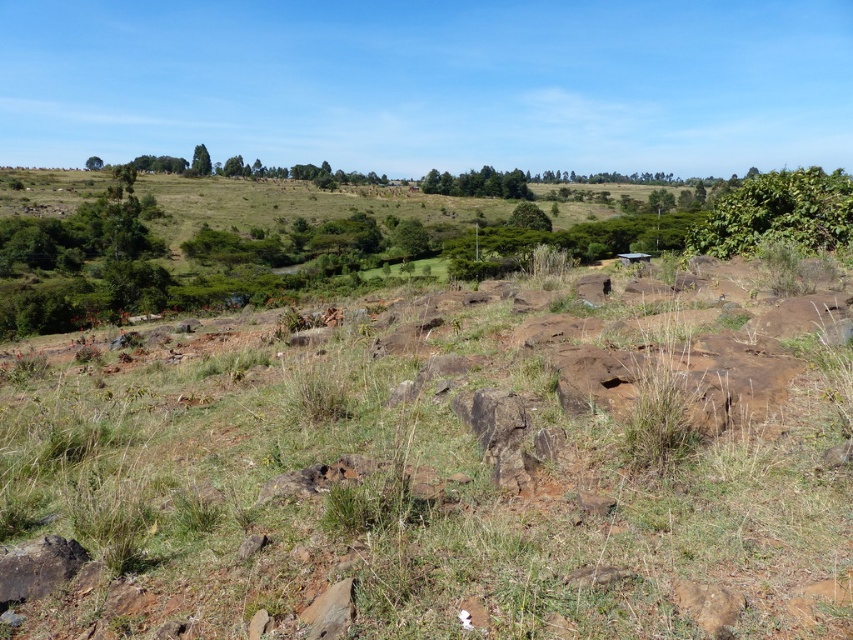
You are a hiker trying to find the shortest path to the dense forest in the background. You notice the green grassy at center and the green leafy trees at center. Which of these two features is closer to your current position?

The green grassy at center is closer to your current position because it is not as tall as the green leafy trees at center, indicating it is in the foreground.

You are an environmental scientist studying the landscape. You need to determine the relative positions of the green leafy trees at center and the green rough bark tree at upper left. Which tree is positioned lower in the image?

The green leafy trees at center is located below green rough bark tree at upper left, so the green leafy trees at center is positioned lower in the image.

You are planning to plant a new flower bed in the open landscape. You have two spots in mind near the green leafy bush at upper right and the green rough bark tree at upper left. Which spot would you choose if you want a wider area for planting?

The green rough bark tree at upper left has a greater width than the green leafy bush at upper right, so choosing the spot near the green rough bark tree at upper left would provide a wider area for planting.